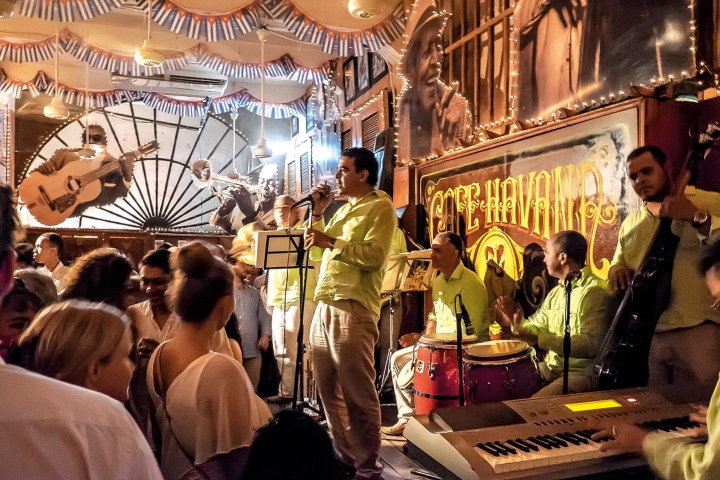
In order to click on mic in this screenshot , I will do `click(312, 204)`.